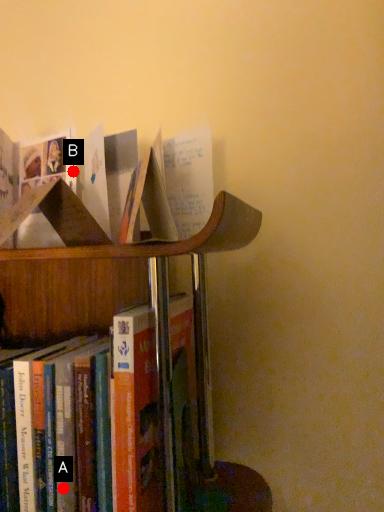
Question: Two points are circled on the image, labeled by A and B beside each circle. Which point is closer to the camera?

Choices:
 (A) A is closer
 (B) B is closer

Answer: (A)